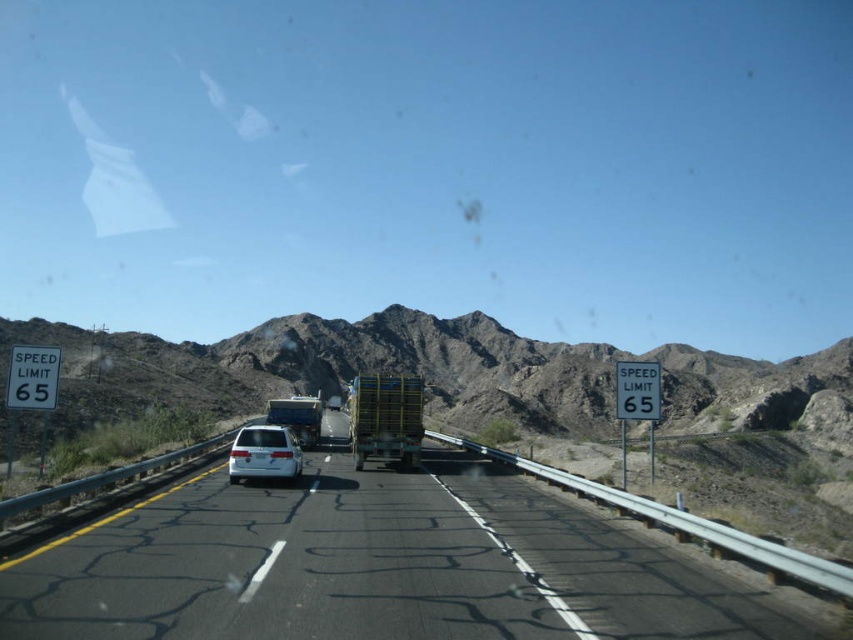
Is yellow mesh trailer truck at center below brushed metal trailer truck at center?

Incorrect, yellow mesh trailer truck at center is not positioned below brushed metal trailer truck at center.

Does point (364, 429) lie in front of point (297, 400)?

Yes, point (364, 429) is closer to viewer.

Which is in front, point (398, 454) or point (299, 419)?

Point (398, 454) is in front.

Find the location of a particular element. The height and width of the screenshot is (640, 853). yellow mesh trailer truck at center is located at coordinates (386, 419).

Which is behind, point (53, 566) or point (285, 474)?

The point (285, 474) is more distant.

Identify the location of black asphalt highway at center. (375, 566).

Identify the location of black asphalt highway at center. (375, 566).

Is black asphalt highway at center positioned in front of yellow mesh trailer truck at center?

Yes, it is.

Is black asphalt highway at center smaller than yellow mesh trailer truck at center?

Indeed, black asphalt highway at center has a smaller size compared to yellow mesh trailer truck at center.

Does point (795, 627) come closer to viewer compared to point (376, 445)?

Yes, it is.

Locate an element on the screen. black asphalt highway at center is located at coordinates coord(375,566).